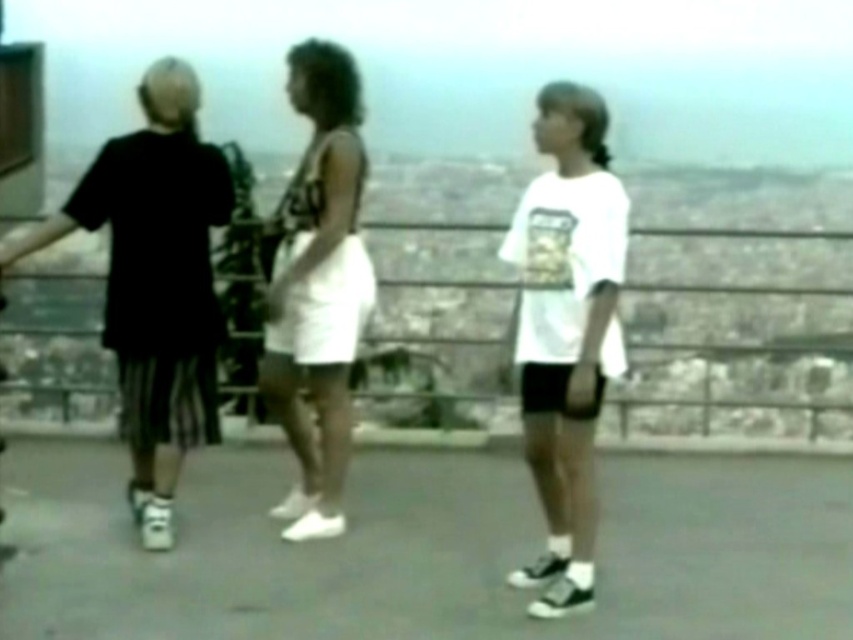
Question: Which object appears farthest from the camera in this image?

Choices:
 (A) black cotton shorts at left
 (B) white matte t-shirt at center
 (C) white matte skirt at center

Answer: (C)

Question: Is black cotton shorts at left smaller than white matte t-shirt at center?

Choices:
 (A) yes
 (B) no

Answer: (B)

Question: Can you confirm if white matte t-shirt at center is bigger than white matte skirt at center?

Choices:
 (A) no
 (B) yes

Answer: (A)

Question: Does white matte t-shirt at center have a larger size compared to white matte skirt at center?

Choices:
 (A) no
 (B) yes

Answer: (A)

Question: Among these objects, which one is farthest from the camera?

Choices:
 (A) white matte t-shirt at center
 (B) white matte skirt at center

Answer: (B)

Question: Estimate the real-world distances between objects in this image. Which object is farther from the white matte t-shirt at center?

Choices:
 (A) white matte skirt at center
 (B) black cotton shorts at left

Answer: (B)